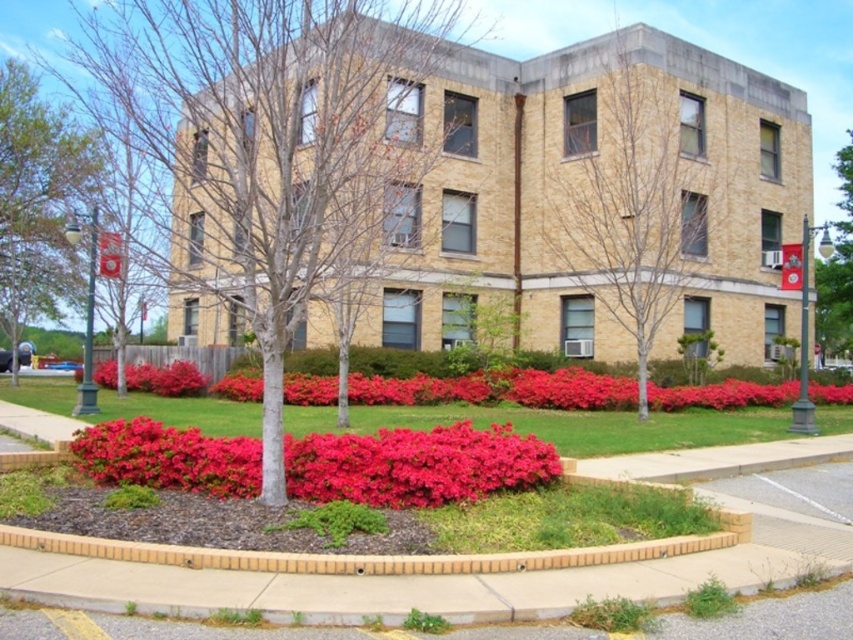
Based on the photo, can you confirm if green leafy tree at left is positioned to the right of green leafy tree at right?

In fact, green leafy tree at left is to the left of green leafy tree at right.

What do you see at coordinates (36, 202) in the screenshot? This screenshot has height=640, width=853. I see `green leafy tree at left` at bounding box center [36, 202].

Measure the distance between point (97, 170) and camera.

Point (97, 170) and camera are 107.77 feet apart from each other.

Identify the location of green leafy tree at left. (36, 202).

Between brick at lower center and green leafy tree at right, which one appears on the right side from the viewer's perspective?

Positioned to the right is green leafy tree at right.

The image size is (853, 640). Describe the element at coordinates (363, 554) in the screenshot. I see `brick at lower center` at that location.

Find the location of a particular element. The image size is (853, 640). brick at lower center is located at coordinates (363, 554).

Locate an element on the screen. brick at lower center is located at coordinates (x=363, y=554).

Can you confirm if green leafy tree at left is positioned to the left of vibrant red petals at center?

Yes, green leafy tree at left is to the left of vibrant red petals at center.

Is green leafy tree at left shorter than vibrant red petals at center?

No.

Between point (47, 136) and point (137, 378), which one is positioned in front?

Point (137, 378) is more forward.

What are the coordinates of `green leafy tree at left` in the screenshot? It's located at pyautogui.click(x=36, y=202).